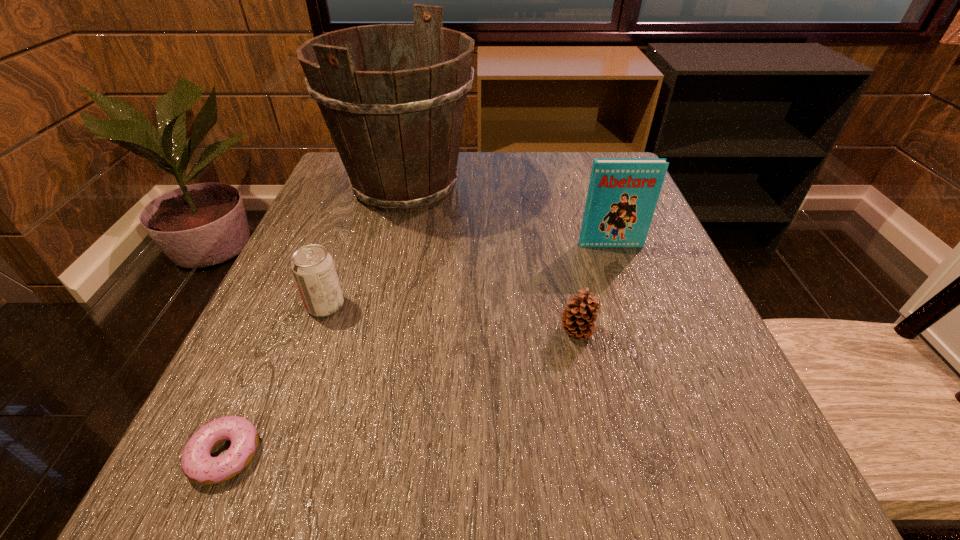
At what (x,y) coordinates should I click in order to perform the action: click on the farthest object. Please return your answer as a coordinate pair (x, y). Looking at the image, I should click on (398, 132).

Where is `bucket`? The width and height of the screenshot is (960, 540). bucket is located at coordinates (398, 132).

Identify the location of the second farthest object. (622, 195).

Where is `the rightmost object`? Image resolution: width=960 pixels, height=540 pixels. the rightmost object is located at coordinates (622, 195).

Locate an element on the screen. Image resolution: width=960 pixels, height=540 pixels. soda can is located at coordinates (313, 268).

Find the location of a particular element. the fourth object from left to right is located at coordinates (578, 318).

What are the coordinates of `pinecone` in the screenshot? It's located at (578, 318).

Locate an element on the screen. Image resolution: width=960 pixels, height=540 pixels. the nearest object is located at coordinates (198, 465).

Image resolution: width=960 pixels, height=540 pixels. I want to click on doughnut, so click(x=198, y=465).

The width and height of the screenshot is (960, 540). Identify the location of vacant space located 0.360m on the front of the tallest object. (360, 374).